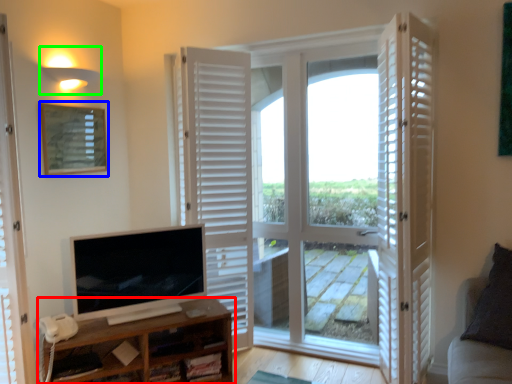
Question: Which object is the farthest from shelf (highlighted by a red box)? Choose among these: picture frame (highlighted by a blue box) or light fixture (highlighted by a green box).

Choices:
 (A) picture frame
 (B) light fixture

Answer: (B)